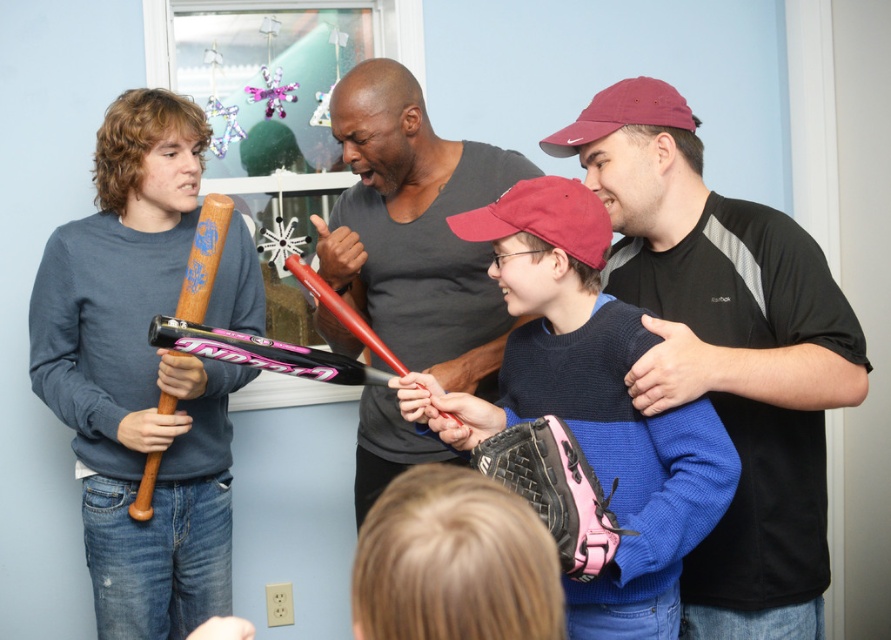
Question: Does maroon fabric cap at upper right appear on the left side of smooth gray shirt at center?

Choices:
 (A) yes
 (B) no

Answer: (B)

Question: Which point is closer to the camera?

Choices:
 (A) shiny red bat at center
 (B) wooden baseball bat at left

Answer: (A)

Question: Which is nearer to the pink leather baseball glove at center?

Choices:
 (A) maroon fabric baseball cap at upper right
 (B) pink leather baseball glove at lower center

Answer: (B)

Question: Can you confirm if maroon fabric cap at upper right is positioned below maroon fabric baseball cap at upper right?

Choices:
 (A) no
 (B) yes

Answer: (B)

Question: Can you confirm if pink leather baseball glove at lower center is bigger than wooden baseball bat at left?

Choices:
 (A) yes
 (B) no

Answer: (B)

Question: Among these points, which one is nearest to the camera?

Choices:
 (A) (398, 180)
 (B) (609, 422)
 (C) (334, 291)
 (D) (571, 147)

Answer: (B)